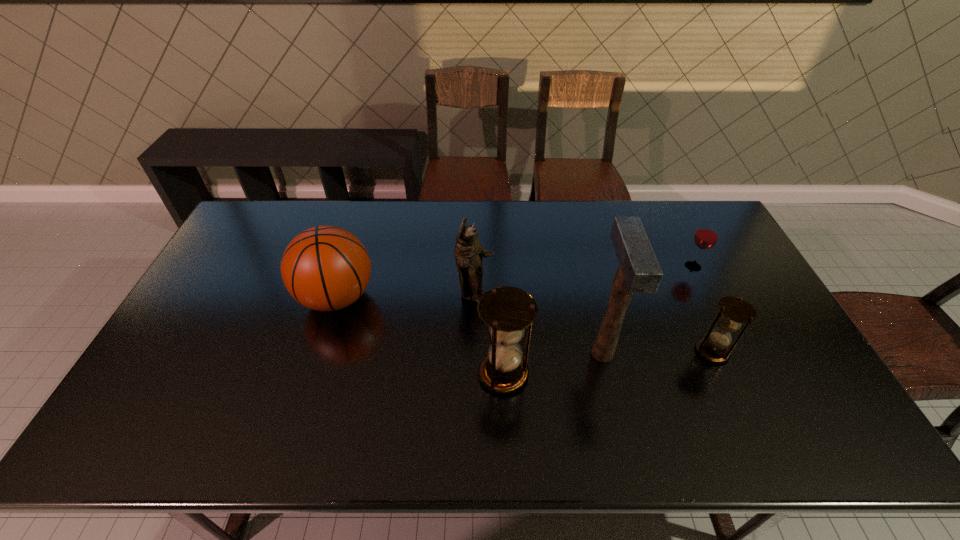
Observe the arrangement of all hourglasss in the image. To keep them evenly spaced, where would you place another hourglass on the left? Please locate a free space. Please provide its 2D coordinates. Your answer should be formatted as a tuple, i.e. [(x, y)], where the tuple contains the x and y coordinates of a point satisfying the conditions above.

[(276, 397)]